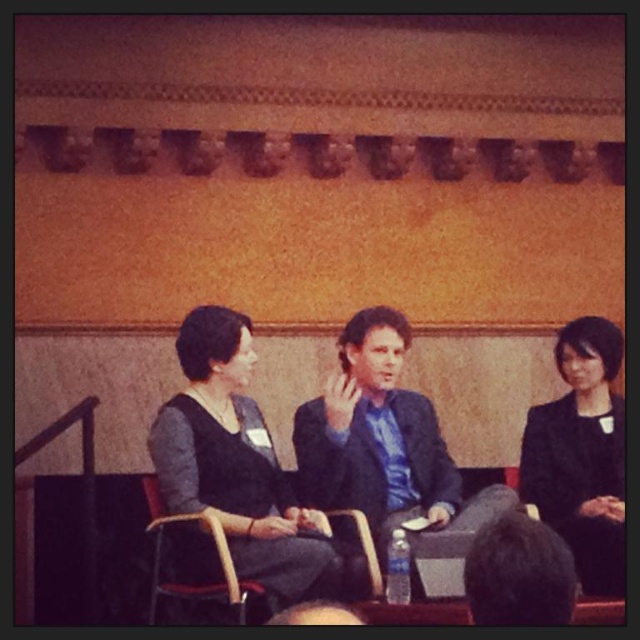
You are sitting in the audience and want to hand a note to the person in the blue satin suit at center and the person in the black matte blazer at right. Which one would be easier to reach without moving from your seat?

The blue satin suit at center is closer to the viewer than the black matte blazer at right, so it would be easier to reach the person in the blue satin suit at center without moving from your seat.

Looking at this image, you are attending a panel discussion and want to find the speaker wearing the blue satin suit at center. Based on the coordinates provided, where should you look in the image?

The blue satin suit at center is located at point coordinates [387,449], so you should look towards the lower right area of the image since the coordinate system likely places [0,0] at the top left corner.

You are organizing a photo shoot and need to ensure that the outfits are arranged by size from smallest to largest. Given the blue satin suit at center and the black matte blazer at right, which should come first in the arrangement?

The black matte blazer at right should come first since it is smaller than the blue satin suit at center.